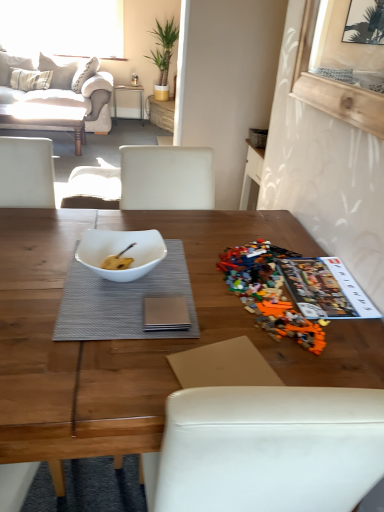
Identify the location of blank space above wooden table at center, placed as the 2th coffee table when sorted from back to front (from a real-world perspective). This screenshot has width=384, height=512. (146, 287).